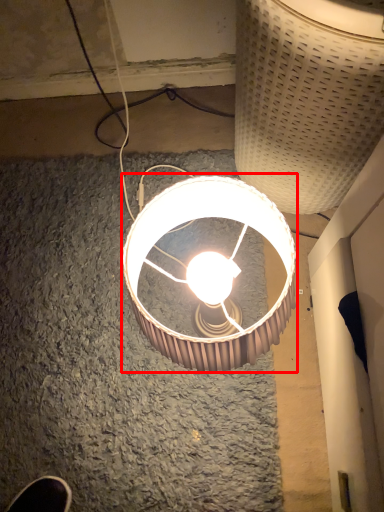
Question: From the image's perspective, considering the relative positions of lamp (annotated by the red box) and lamp in the image provided, where is lamp (annotated by the red box) located with respect to the staircase?

Choices:
 (A) above
 (B) below

Answer: (B)